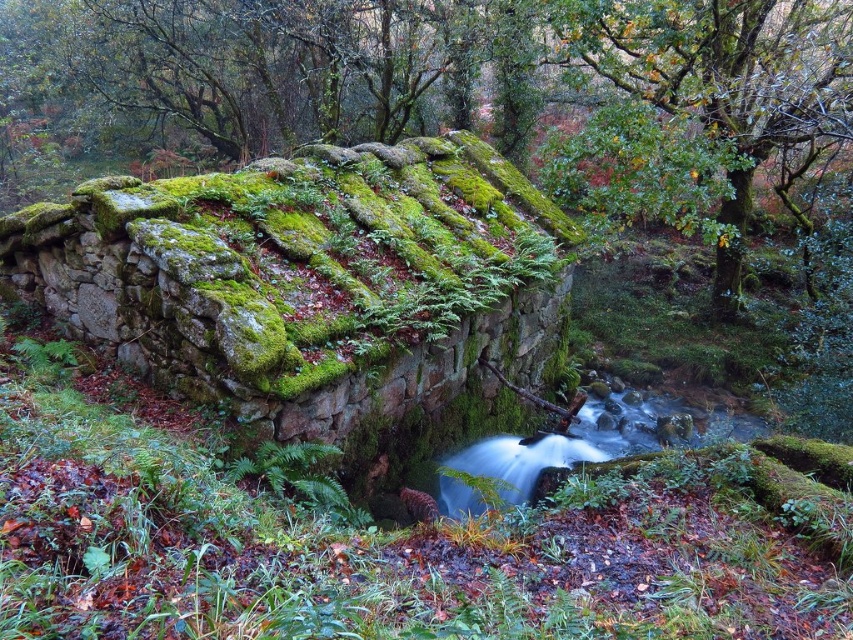
You are a hiker who just arrived at the stream. You see the green mossy stone wall at center and the clear water at center. Which object is above the other?

The green mossy stone wall at center is positioned over the clear water at center, so the stone wall is above the water.

You are standing at the edge of the stream near the old stone structure. You notice two points marked in the image. Which of the two points, point (328, 428) or point (447, 497), is closer to you?

Point (328, 428) is closer to the viewer than point (447, 497).

You are standing at the edge of the stream near the old stone structure. You notice a point marked at coordinates (310, 284). What does this point represent in the scene?

The point at (310, 284) indicates the green mossy stone wall at center.